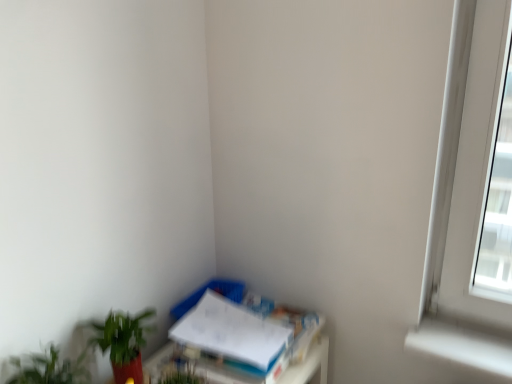
Question: From a real-world perspective, is green leafy plant at lower left, acting as the 1th houseplant starting from the front, above or below green matte plant at lower left, which is the 2th houseplant in front-to-back order?

Choices:
 (A) above
 (B) below

Answer: (A)

Question: Is green leafy plant at lower left, acting as the second houseplant starting from the back, bigger or smaller than green matte plant at lower left, which appears as the first houseplant when viewed from the back?

Choices:
 (A) big
 (B) small

Answer: (B)

Question: Which object is the closest to the white paper at lower right?

Choices:
 (A) green matte plant at lower left, which is the 2th houseplant in front-to-back order
 (B) green leafy plant at lower left, acting as the 1th houseplant starting from the front

Answer: (A)

Question: Based on their relative distances, which object is farther from the white paper at lower right?

Choices:
 (A) green leafy plant at lower left, acting as the second houseplant starting from the back
 (B) green matte plant at lower left, which is the 2th houseplant in front-to-back order

Answer: (A)